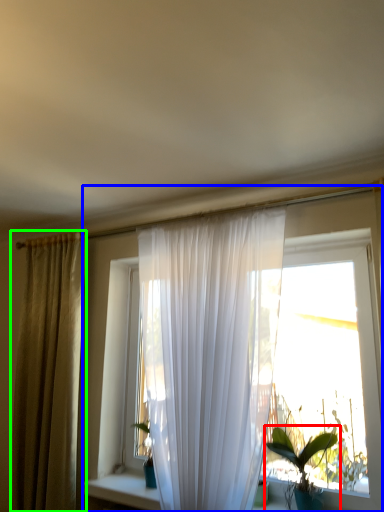
Question: Which object is the closest to the houseplant (highlighted by a red box)? Choose among these: window (highlighted by a blue box) or curtain (highlighted by a green box).

Choices:
 (A) window
 (B) curtain

Answer: (A)